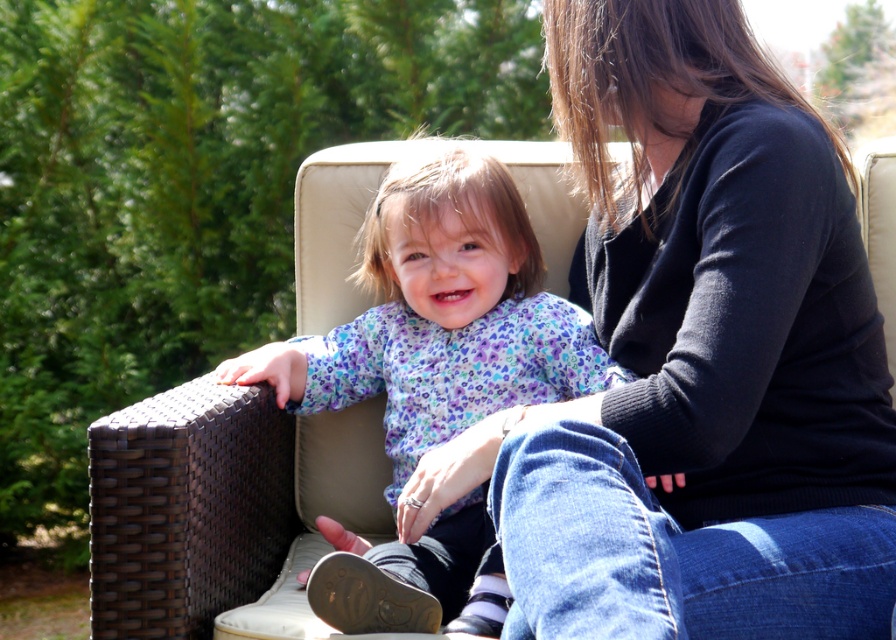
Question: Where is black sweater at upper right located in relation to purple floral shirt at center in the image?

Choices:
 (A) above
 (B) below

Answer: (A)

Question: Which point is closer to the camera?

Choices:
 (A) (694, 422)
 (B) (533, 301)

Answer: (A)

Question: Which point is closer to the camera taking this photo?

Choices:
 (A) (795, 588)
 (B) (410, 161)

Answer: (A)

Question: Can you confirm if black sweater at upper right is thinner than purple floral shirt at center?

Choices:
 (A) yes
 (B) no

Answer: (A)

Question: Is black sweater at upper right in front of purple floral shirt at center?

Choices:
 (A) yes
 (B) no

Answer: (A)